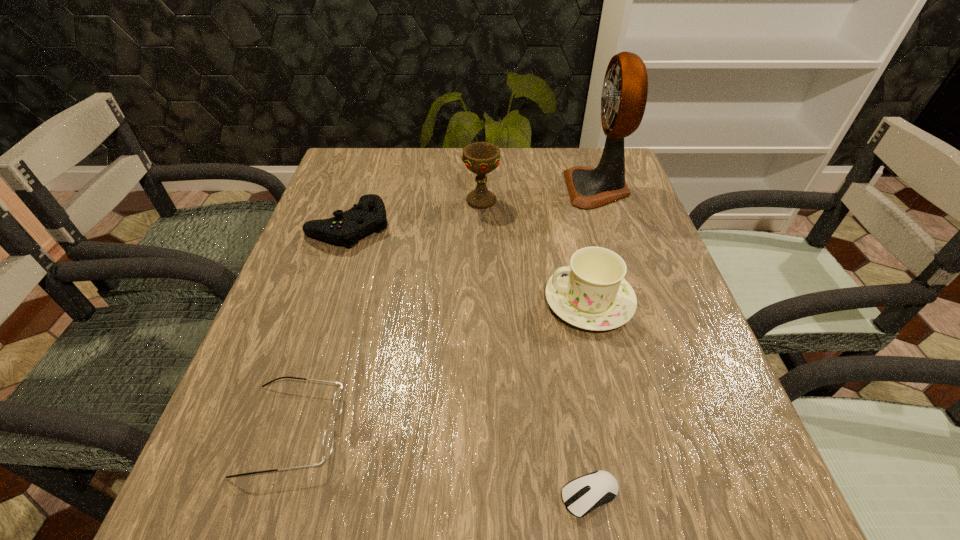
The height and width of the screenshot is (540, 960). I want to click on vacant space situated 0.370m on the front-facing side of the tallest object, so click(x=427, y=188).

Image resolution: width=960 pixels, height=540 pixels. What are the coordinates of `free point located on the left of the third object from left to right` in the screenshot? It's located at (353, 201).

Find the location of a particular element. free space located on the handle side of the fourth shortest object is located at coordinates (440, 301).

Where is `vacant space located 0.260m on the handle side of the fourth shortest object`? The height and width of the screenshot is (540, 960). vacant space located 0.260m on the handle side of the fourth shortest object is located at coordinates (415, 301).

This screenshot has height=540, width=960. I want to click on free location located on the handle side of the fourth shortest object, so click(x=494, y=301).

You are a GUI agent. You are given a task and a screenshot of the screen. Output one action in this format:
    pyautogui.click(x=<x>, y=<y>)
    Task: Click on the vacant space positioned on the right of the control
    
    Given the screenshot: What is the action you would take?
    pyautogui.click(x=436, y=225)

Locate an element on the screen. This screenshot has width=960, height=540. vacant space located 0.120m through the lenses of the fifth tallest object is located at coordinates (416, 429).

At what (x,y) coordinates should I click in order to perform the action: click on vacant space located 0.240m on the back of the mouse. Please return your answer as a coordinate pair (x, y). Looking at the image, I should click on 564,340.

This screenshot has height=540, width=960. What are the coordinates of `fan situated at the far edge` in the screenshot? It's located at (624, 95).

Where is `chalice that is at the far edge`? This screenshot has height=540, width=960. chalice that is at the far edge is located at coordinates (481, 158).